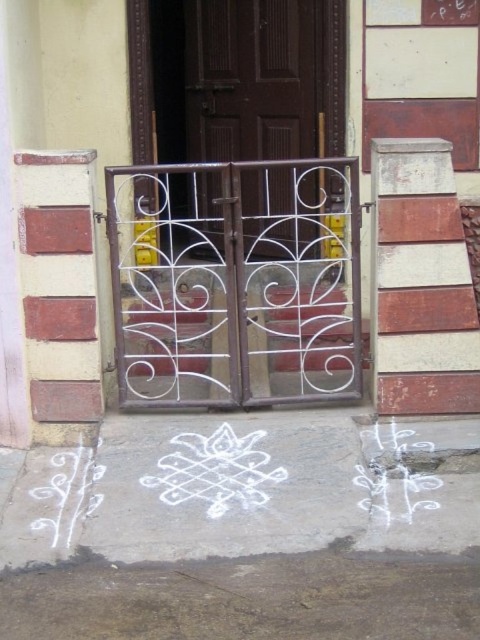
The width and height of the screenshot is (480, 640). Describe the element at coordinates (250, 80) in the screenshot. I see `brown matte door at center` at that location.

Between brown matte door at center and white chalk design at lower left, which one has less height?

With less height is white chalk design at lower left.

Is point (196, 93) positioned before point (58, 451)?

No, it is behind (58, 451).

This screenshot has width=480, height=640. I want to click on brown matte door at center, so click(x=250, y=80).

Between white chalk design at lower center and brown matte door at center, which one has less height?

Standing shorter between the two is white chalk design at lower center.

Based on the photo, does white chalk design at lower center have a greater height compared to brown matte door at center?

No, white chalk design at lower center is not taller than brown matte door at center.

Measure the distance between point (272, 422) and camera.

Point (272, 422) and camera are 4.74 meters apart from each other.

Locate an element on the screen. This screenshot has height=640, width=480. white chalk design at lower center is located at coordinates (244, 529).

Measure the distance between brown matte door at center and camera.

brown matte door at center is 5.75 meters from camera.

Looking at this image, which of these two, brown matte door at center or white chalk drawing at center, stands shorter?

white chalk drawing at center is shorter.

Between point (272, 74) and point (252, 483), which one is positioned behind?

Point (272, 74)

Locate an element on the screen. brown matte door at center is located at coordinates (250, 80).